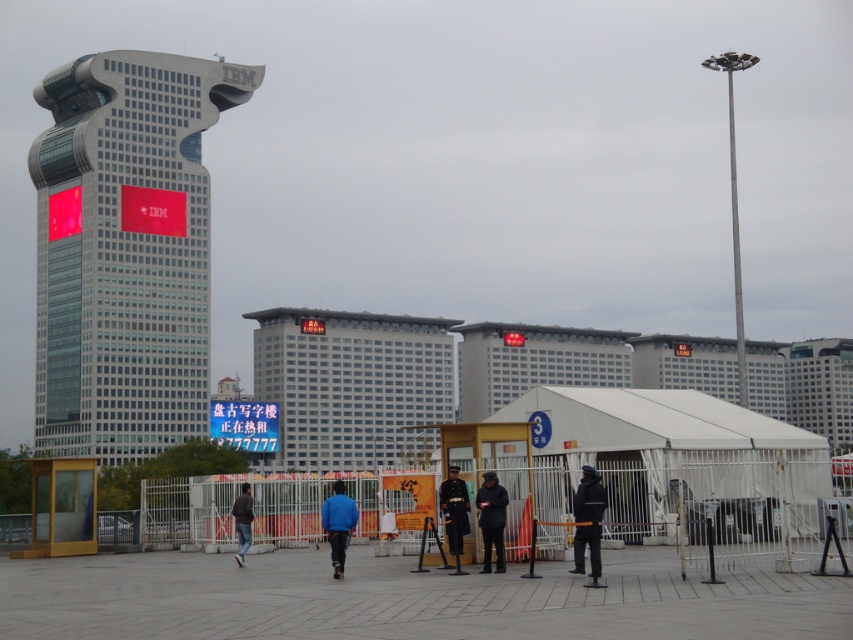
Does point (585, 540) come in front of point (234, 557)?

Yes, point (585, 540) is in front of point (234, 557).

Can you confirm if dark blue jacket at center is shorter than dark gray jacket at center?

Incorrect, dark blue jacket at center's height does not fall short of dark gray jacket at center's.

Is point (596, 518) less distant than point (247, 547)?

Yes, it is in front of point (247, 547).

Identify the location of dark blue jacket at center. This screenshot has height=640, width=853. (589, 522).

Between white glass building at center and dark blue jacket at center, which one has more height?

Standing taller between the two is white glass building at center.

Does white glass building at center appear on the right side of dark blue jacket at center?

In fact, white glass building at center is to the left of dark blue jacket at center.

Is point (399, 435) closer to camera compared to point (596, 554)?

No, it is behind (596, 554).

Identify the location of white glass building at center. (352, 385).

In the scene shown: Who is positioned more to the right, white glass building at center or dark blue uniform at center?

dark blue uniform at center

Based on the photo, is white glass building at center to the left of dark blue uniform at center from the viewer's perspective?

Correct, you'll find white glass building at center to the left of dark blue uniform at center.

The width and height of the screenshot is (853, 640). In order to click on white glass building at center in this screenshot , I will do `click(352, 385)`.

Identify the location of white glass building at center. Image resolution: width=853 pixels, height=640 pixels. (352, 385).